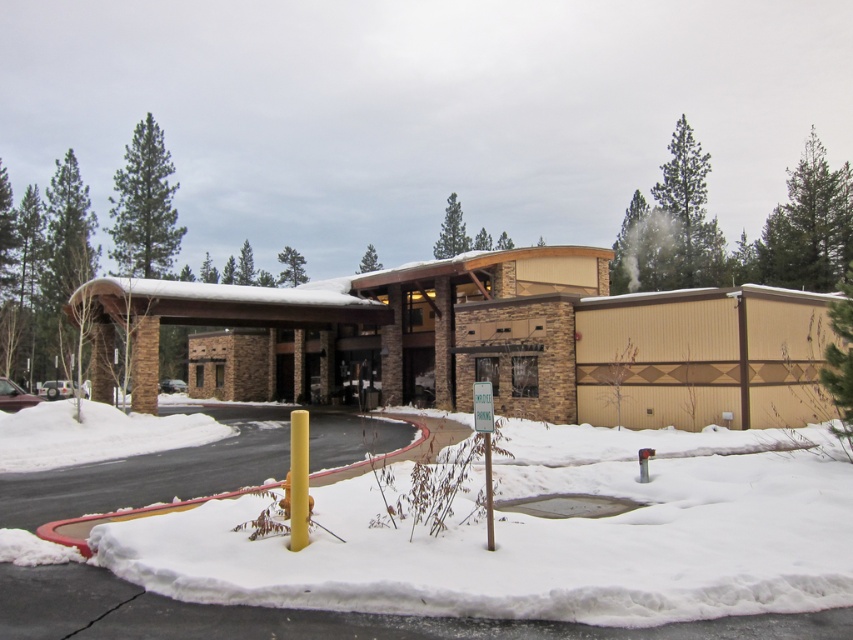
You are standing in front of the beige wood hotel at center and want to walk towards the white fluffy snow at lower left. Is the snow closer or farther away from you compared to the hotel?

The white fluffy snow at lower left is closer to the viewer than the beige wood hotel at center, so the snow is closer to you than the hotel.

You are standing at point (538, 540) in the snowy scene. What do you see immediately to your lower left?

At point (538, 540), the immediate lower left area has white fluffy snow.